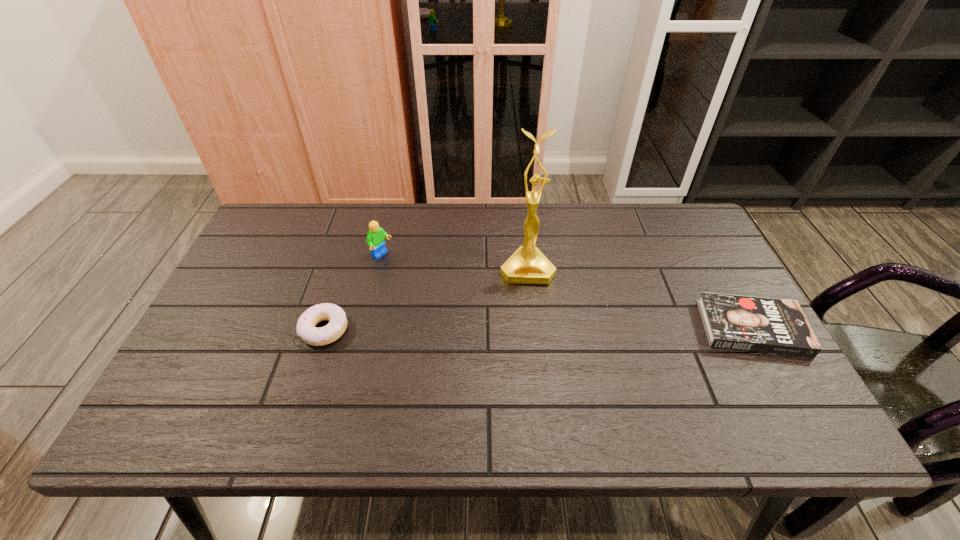
Find the location of `vacant spot on the desktop that is between the leftmost object and the book and is positioned on the front-facing side of the award`. vacant spot on the desktop that is between the leftmost object and the book and is positioned on the front-facing side of the award is located at coordinates (535, 328).

Identify the location of free space on the desktop that is between the second shortest object and the shortest object and is positioned on the face of the Lego. (498, 329).